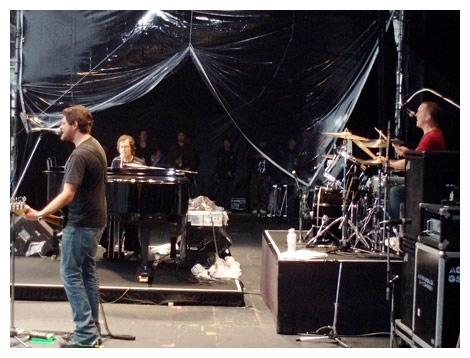
Locate an element on the screen. leg of the piano is located at coordinates (143, 246).